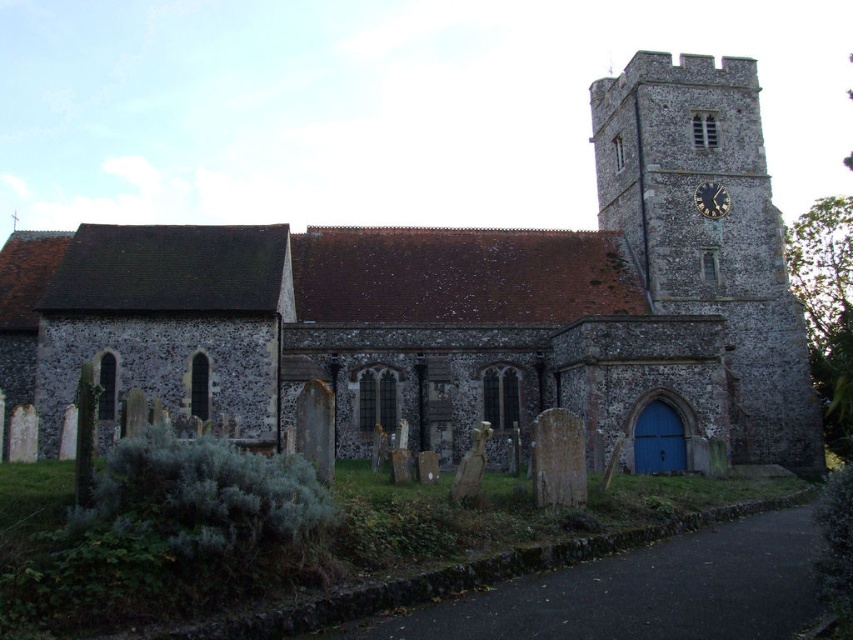
You are standing in front of the church and want to take a photo. You notice two points marked on the church wall. The first point is at coordinate point [630,148] and the second is at point [746,371]. Which point will appear closer to you in the photo?

Point [630,148] is further to the camera than point [746,371], so the second point will appear closer to you in the photo.

You are standing in front of the stone church at center and want to take a photo of the stone clock tower at upper right. Since the church is blocking part of your view, can you move to the left or right to get a clearer shot of the clock tower without the church blocking it?

The stone church at center is in front of the stone clock tower at upper right, so moving to the left would allow you to see the clock tower without the church blocking it.

You are standing in front of the traditional stone church and looking up. You see the stone clock tower at upper right and the gold metallic clock at upper right. Which one is positioned higher?

The gold metallic clock at upper right is positioned higher than the stone clock tower at upper right because the stone clock tower at upper right is below the gold metallic clock at upper right.